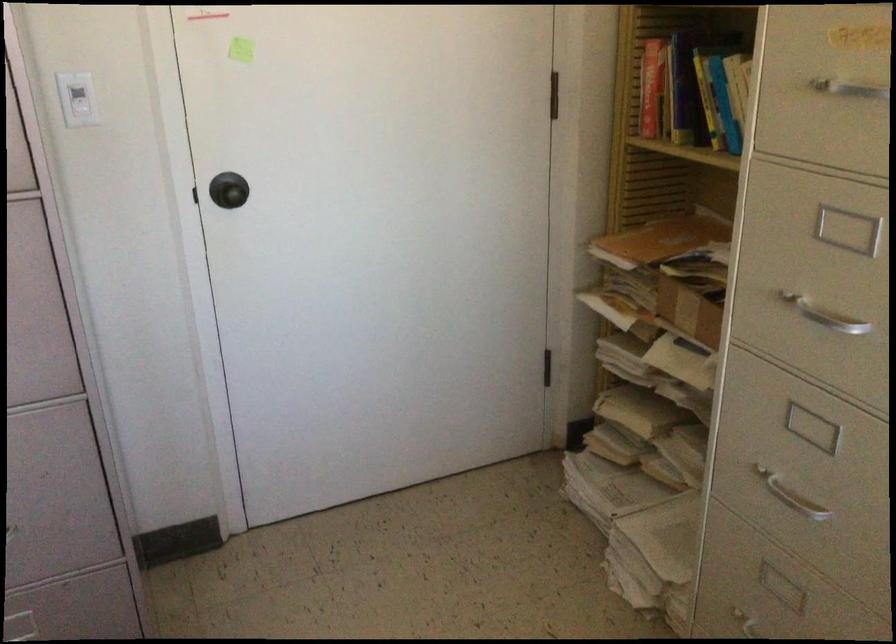
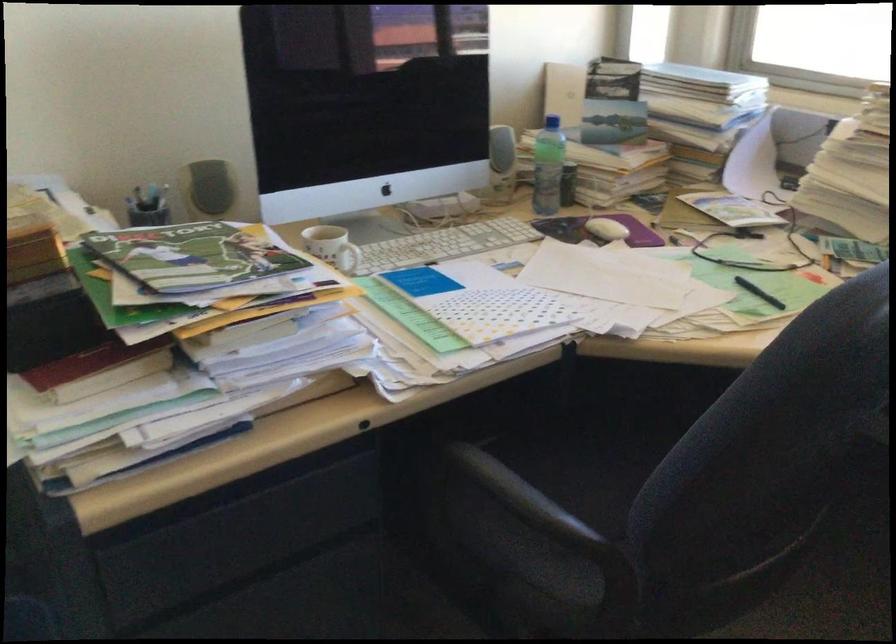
The images are taken continuously from a first-person perspective. In which direction is your viewpoint rotating?

The camera rotated toward right-down.